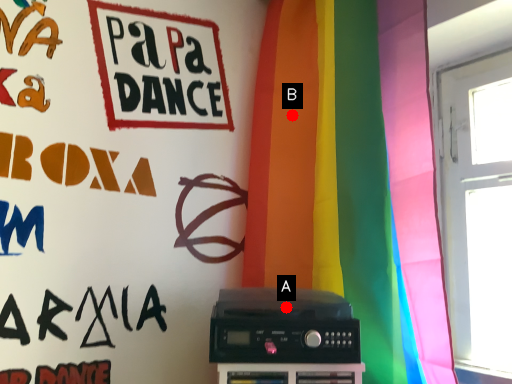
Question: Two points are circled on the image, labeled by A and B beside each circle. Which point is closer to the camera taking this photo?

Choices:
 (A) A is closer
 (B) B is closer

Answer: (A)